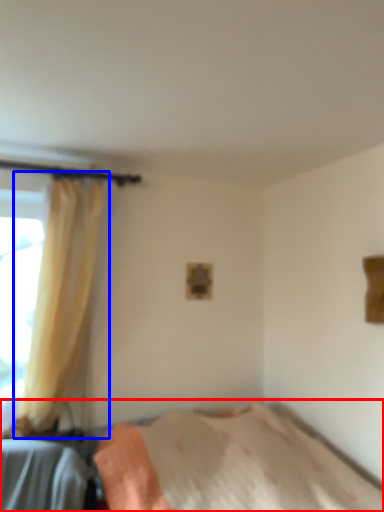
Question: Which of the following is the farthest to the observer, bed (highlighted by a red box) or curtain (highlighted by a blue box)?

Choices:
 (A) bed
 (B) curtain

Answer: (B)